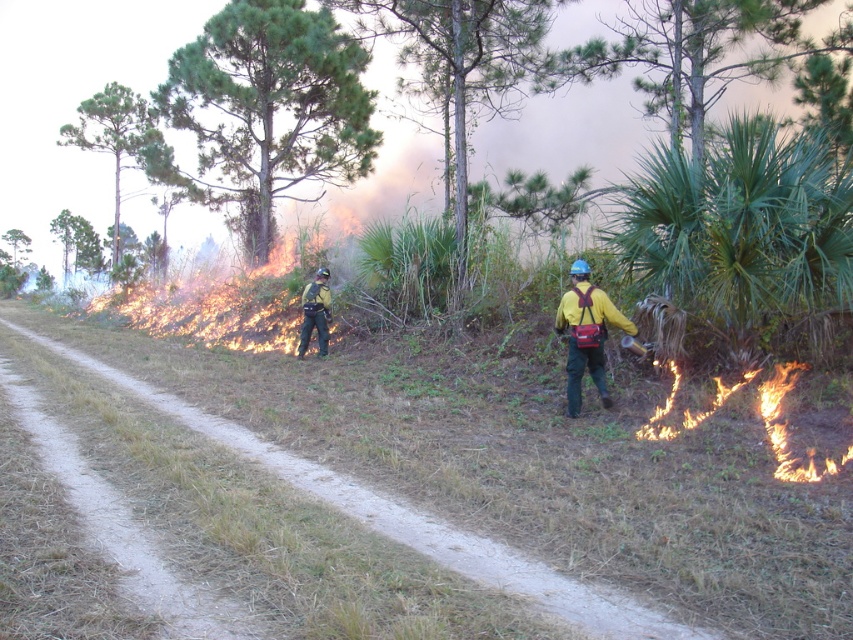
You are a firefighter planning to move from the brown dirt path at center to the yellow matte jacket at right during a controlled burn. Based on their sizes, which object will be easier to navigate around?

The brown dirt path at center is larger in size than the yellow matte jacket at right, so it will be easier to navigate around the smaller yellow matte jacket at right.

You are a firefighter in the field. You see a point at coordinates (x=585, y=333). According to the scene, where is this point located?

The point at coordinates (x=585, y=333) is located on the yellow matte jacket at right.

You are a firefighter observing the controlled burn scene. You need to quickly assess the situation. Which object, the brown dirt path at center or the matte black uniform at center, is closer to your vantage point?

The brown dirt path at center is closer to your vantage point because it is in front of the matte black uniform at center.